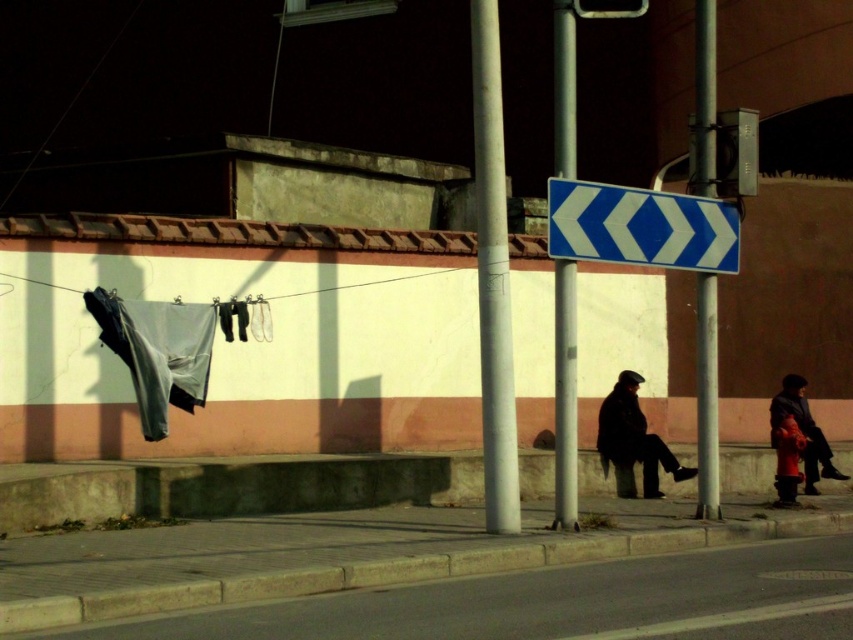
This screenshot has width=853, height=640. In order to click on gray fabric at left in this screenshot , I will do `click(157, 352)`.

Locate an element on the screen. gray fabric at left is located at coordinates (157, 352).

Between white smooth pole at center and dark brown leather jacket at lower center, which one is positioned lower?

dark brown leather jacket at lower center is below.

Does point (477, 3) lie in front of point (637, 436)?

Yes.

At what (x,y) coordinates should I click in order to perform the action: click on white smooth pole at center. Please return your answer as a coordinate pair (x, y). Looking at the image, I should click on (492, 276).

Is smooth metal pole at center to the right of red woolen coat at lower right from the viewer's perspective?

In fact, smooth metal pole at center is to the left of red woolen coat at lower right.

Is smooth metal pole at center smaller than red woolen coat at lower right?

Yes.

Who is more distant from viewer, (561, 314) or (820, 458)?

The point (820, 458) is more distant.

Find the location of a particular element. The height and width of the screenshot is (640, 853). smooth metal pole at center is located at coordinates (566, 396).